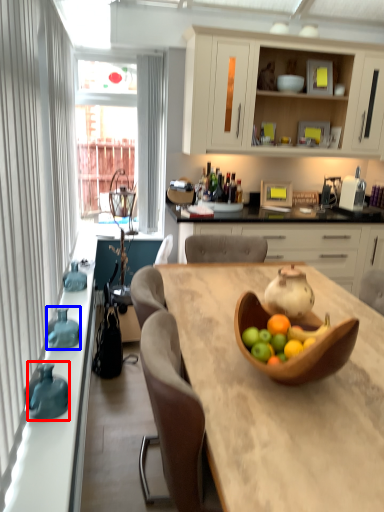
Question: Which point is closer to the camera, vase (highlighted by a red box) or vase (highlighted by a blue box)?

Choices:
 (A) vase
 (B) vase

Answer: (A)